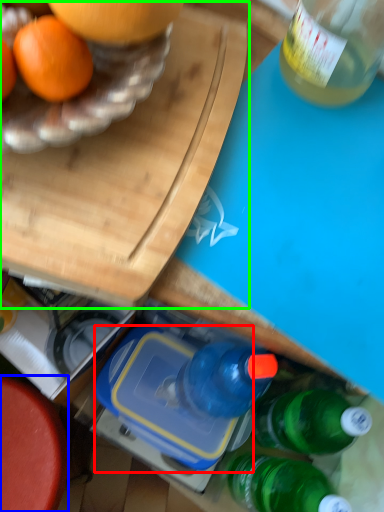
Question: Which object is positioned closest to lunch box (highlighted by a red box)? Select from round table (highlighted by a blue box) and cutting board (highlighted by a green box).

Choices:
 (A) round table
 (B) cutting board

Answer: (A)